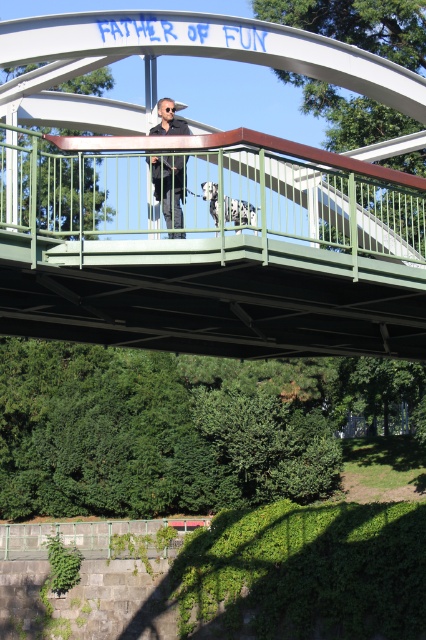
Does point (81, 67) come farther from viewer compared to point (167, 209)?

Yes, point (81, 67) is behind point (167, 209).

Does white metal bridge at center have a larger size compared to matte black shirt at center?

Yes.

Where is `white metal bridge at center`? white metal bridge at center is located at coordinates (221, 250).

What are the coordinates of `white metal bridge at center` in the screenshot? It's located at (221, 250).

Is white metal bridge at center to the right of white spotted fur at center from the viewer's perspective?

Incorrect, white metal bridge at center is not on the right side of white spotted fur at center.

Which is below, white metal bridge at center or white spotted fur at center?

Positioned lower is white spotted fur at center.

You are a GUI agent. You are given a task and a screenshot of the screen. Output one action in this format:
    pyautogui.click(x=<x>, y=<y>)
    Task: Click on the white metal bridge at center
    
    Given the screenshot: What is the action you would take?
    pyautogui.click(x=221, y=250)

Is matte black shirt at center to the right of white spotted fur at center from the viewer's perspective?

No, matte black shirt at center is not to the right of white spotted fur at center.

Between matte black shirt at center and white spotted fur at center, which one appears on the right side from the viewer's perspective?

white spotted fur at center

This screenshot has height=640, width=426. Find the location of `matte black shirt at center`. matte black shirt at center is located at coordinates click(173, 189).